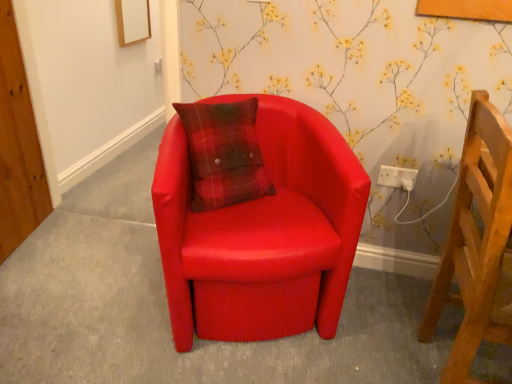
Question: Is matte leather chair at center, which ranks as the 1th chair in left-to-right order, completely or partially inside matte red armchair at center?

Choices:
 (A) no
 (B) yes

Answer: (A)

Question: Can you confirm if matte red armchair at center is positioned to the right of matte leather chair at center, which appears as the second chair when viewed from the right?

Choices:
 (A) no
 (B) yes

Answer: (A)

Question: Does matte red armchair at center have a smaller size compared to matte leather chair at center, which appears as the second chair when viewed from the right?

Choices:
 (A) yes
 (B) no

Answer: (A)

Question: Is matte red armchair at center bigger than matte leather chair at center, which appears as the second chair when viewed from the right?

Choices:
 (A) yes
 (B) no

Answer: (B)

Question: Considering the relative positions of matte red armchair at center and matte leather chair at center, which ranks as the 1th chair in left-to-right order, in the image provided, is matte red armchair at center behind matte leather chair at center, which ranks as the 1th chair in left-to-right order,?

Choices:
 (A) no
 (B) yes

Answer: (B)

Question: In terms of width, does wooden chair at right, which appears as the 2th chair when viewed from the left, look wider or thinner when compared to matte red armchair at center?

Choices:
 (A) wide
 (B) thin

Answer: (B)

Question: From the image's perspective, is wooden chair at right, which appears as the 2th chair when viewed from the left, above or below matte red armchair at center?

Choices:
 (A) below
 (B) above

Answer: (B)

Question: Is point (472, 331) positioned closer to the camera than point (352, 304)?

Choices:
 (A) farther
 (B) closer

Answer: (B)

Question: In the image, is wooden chair at right, positioned as the first chair in right-to-left order, on the left side or the right side of matte red armchair at center?

Choices:
 (A) left
 (B) right

Answer: (B)

Question: In the image, is wooden chair at right, which appears as the 2th chair when viewed from the left, positioned in front of or behind white plastic socket at upper right?

Choices:
 (A) front
 (B) behind

Answer: (A)

Question: Is wooden chair at right, which appears as the 2th chair when viewed from the left, inside the boundaries of white plastic socket at upper right, or outside?

Choices:
 (A) inside
 (B) outside

Answer: (B)

Question: From the image's perspective, is wooden chair at right, positioned as the first chair in right-to-left order, positioned above or below white plastic socket at upper right?

Choices:
 (A) above
 (B) below

Answer: (B)

Question: Is point (445, 263) positioned closer to the camera than point (413, 170)?

Choices:
 (A) closer
 (B) farther

Answer: (A)

Question: Is point (396, 185) positioned closer to the camera than point (111, 336)?

Choices:
 (A) farther
 (B) closer

Answer: (A)

Question: Is white plastic socket at upper right in front of or behind matte red armchair at center in the image?

Choices:
 (A) behind
 (B) front

Answer: (A)